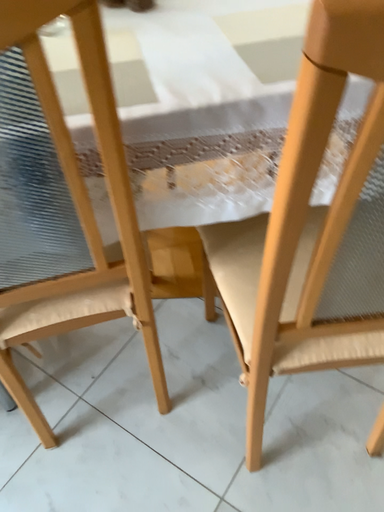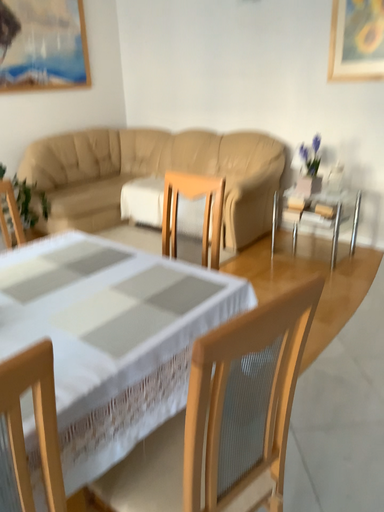
Question: Which way did the camera rotate in the video?

Choices:
 (A) rotated right
 (B) rotated left

Answer: (A)